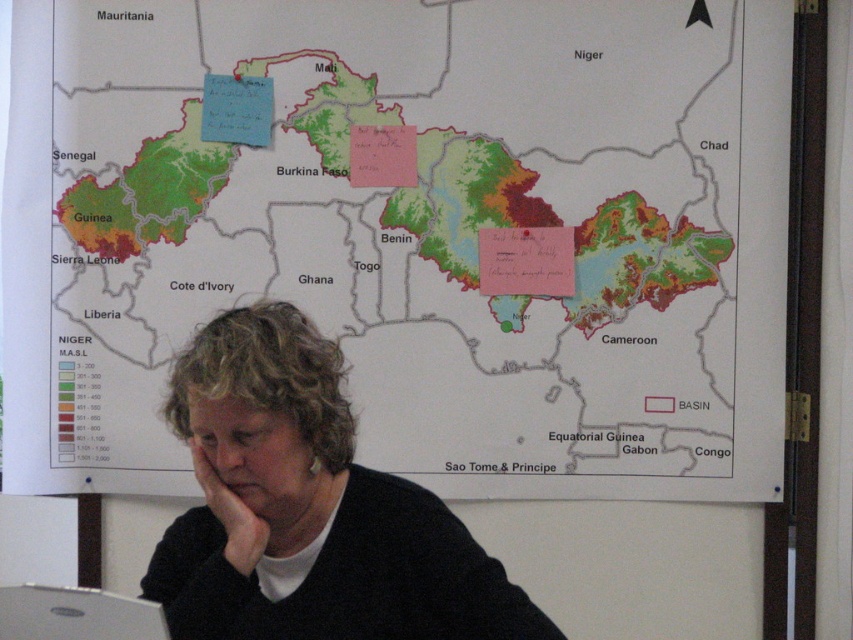
Question: Among these objects, which one is nearest to the camera?

Choices:
 (A) black sweater at lower center
 (B) silver metallic laptop at lower left

Answer: (B)

Question: Observing the image, what is the correct spatial positioning of black sweater at lower center in reference to silver metallic laptop at lower left?

Choices:
 (A) below
 (B) above

Answer: (B)

Question: Observing the image, what is the correct spatial positioning of black sweater at lower center in reference to silver metallic laptop at lower left?

Choices:
 (A) above
 (B) below

Answer: (A)

Question: Can you confirm if black sweater at lower center is smaller than silver metallic laptop at lower left?

Choices:
 (A) no
 (B) yes

Answer: (A)

Question: Which object appears farthest from the camera in this image?

Choices:
 (A) silver metallic laptop at lower left
 (B) black sweater at lower center

Answer: (B)

Question: Which point is farther to the camera?

Choices:
 (A) (28, 625)
 (B) (328, 404)

Answer: (B)